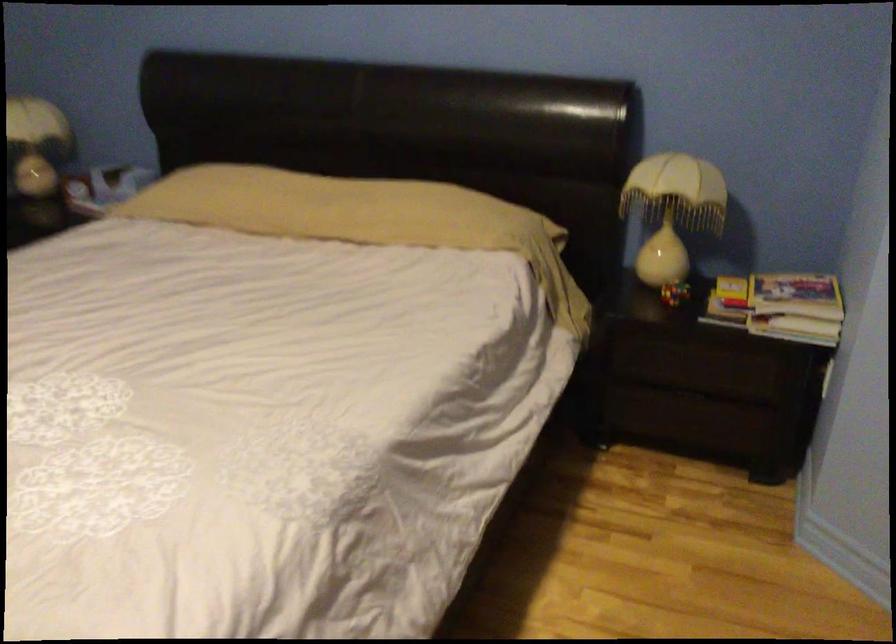
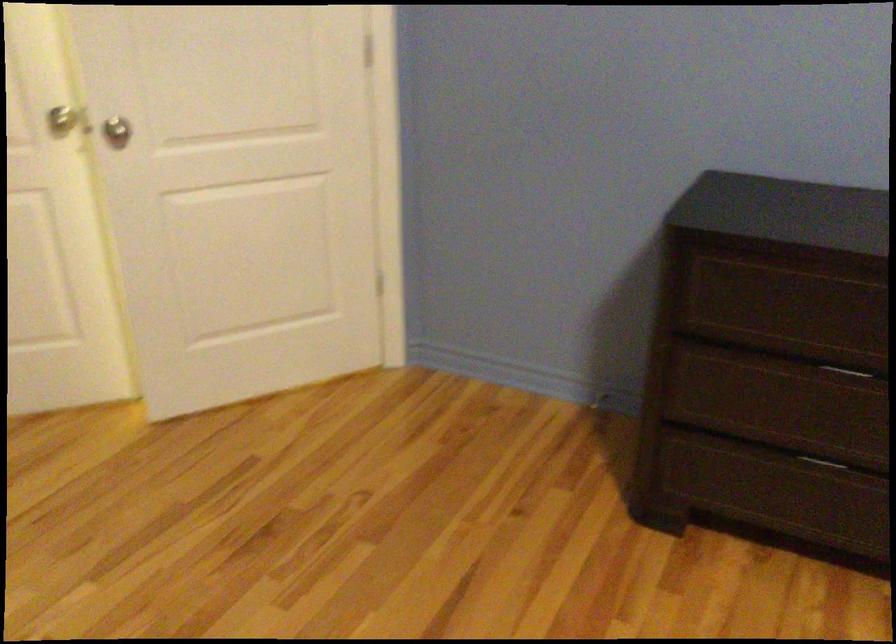
Based on the continuous images, in which direction is the camera rotating?

The rotation direction of the camera is left-down.